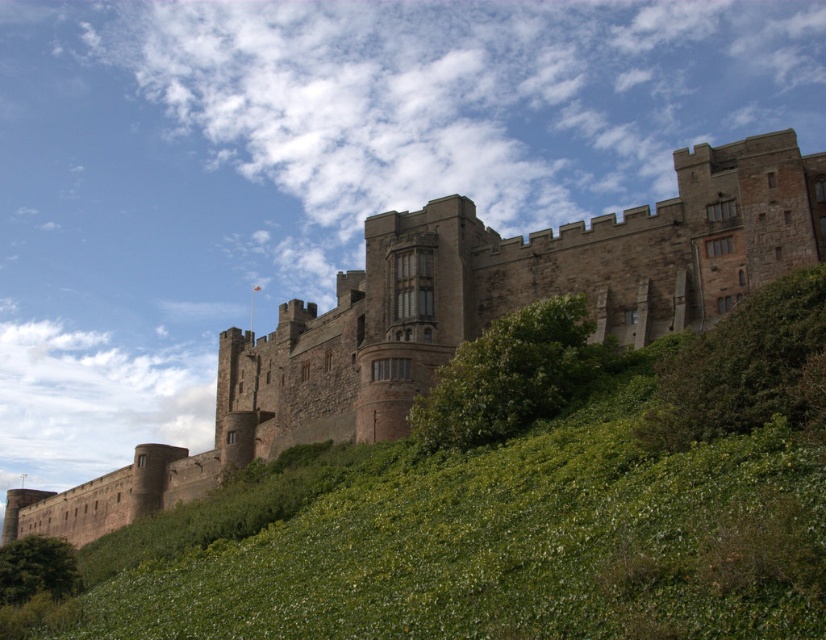
Question: Where is green leafy grass at lower center located in relation to green leafy hedge at lower right in the image?

Choices:
 (A) above
 (B) below

Answer: (B)

Question: Is green leafy grass at lower center behind green leafy hedge at center?

Choices:
 (A) yes
 (B) no

Answer: (B)

Question: Which object is positioned farthest from the green leafy grass at lower center?

Choices:
 (A) green leafy hedge at center
 (B) green leafy hedge at lower left
 (C) brown stone castle at center
 (D) green leafy hedge at lower right

Answer: (C)

Question: Can you confirm if green leafy hedge at lower right is positioned above green leafy hedge at lower left?

Choices:
 (A) no
 (B) yes

Answer: (B)

Question: Among these objects, which one is nearest to the camera?

Choices:
 (A) green leafy hedge at center
 (B) brown stone castle at center
 (C) green leafy hedge at lower right
 (D) green leafy grass at lower center

Answer: (D)

Question: Which object is positioned closest to the green leafy grass at lower center?

Choices:
 (A) green leafy hedge at lower right
 (B) green leafy hedge at lower left

Answer: (A)